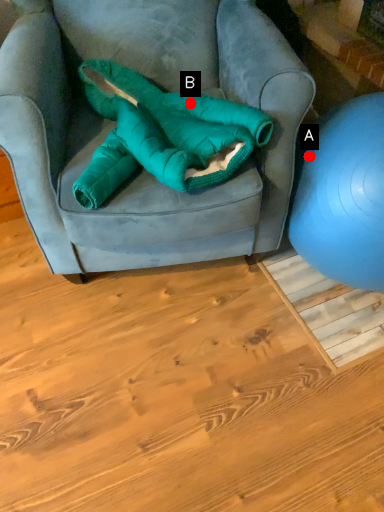
Question: Two points are circled on the image, labeled by A and B beside each circle. Which point is further to the camera?

Choices:
 (A) A is further
 (B) B is further

Answer: (A)